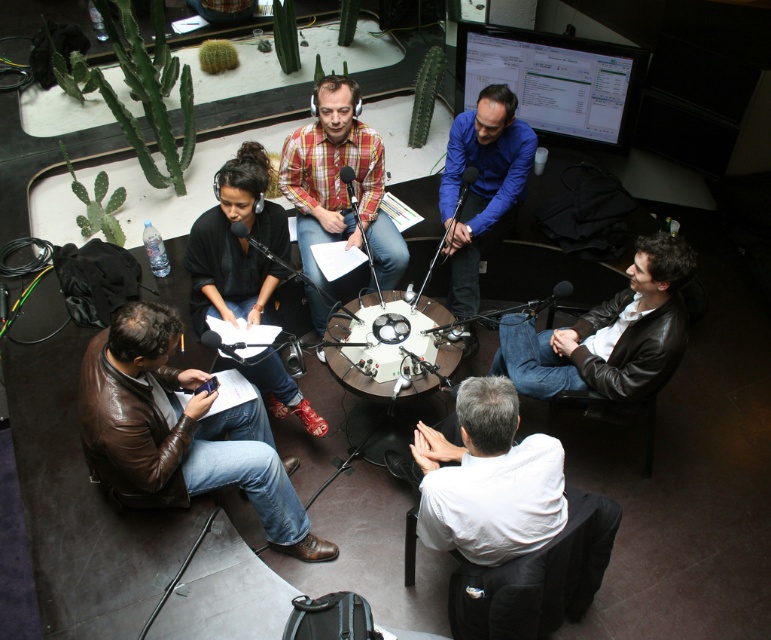
You are a photographer in the studio and need to adjust the lighting to ensure the white glossy round table at center is clearly visible. Since the white matte shirt at lower center is blocking part of the table, where should you move the light to avoid the shadow from the shirt?

The white matte shirt at lower center is on the right side of the white glossy round table at center. To avoid the shadow, move the light to the left side of the table so the shirt doesn

You are a photographer setting up for a group photo. You need to position a light source between the brown leather jacket at lower left and the plaid shirt at center. Based on their positions, which side of the light should face towards the wider object?

The brown leather jacket at lower left is wider than the plaid shirt at center, so the light source should face towards the brown leather jacket at lower left to properly illuminate the wider object.

You are sitting at the round table in the studio. You need to place a small microphone between the two points labeled point (x=328, y=228) and point (x=473, y=220). According to their positions, which point should the microphone be closer to?

The microphone should be placed closer to point (x=328, y=228) because it is in front of point (x=473, y=220).